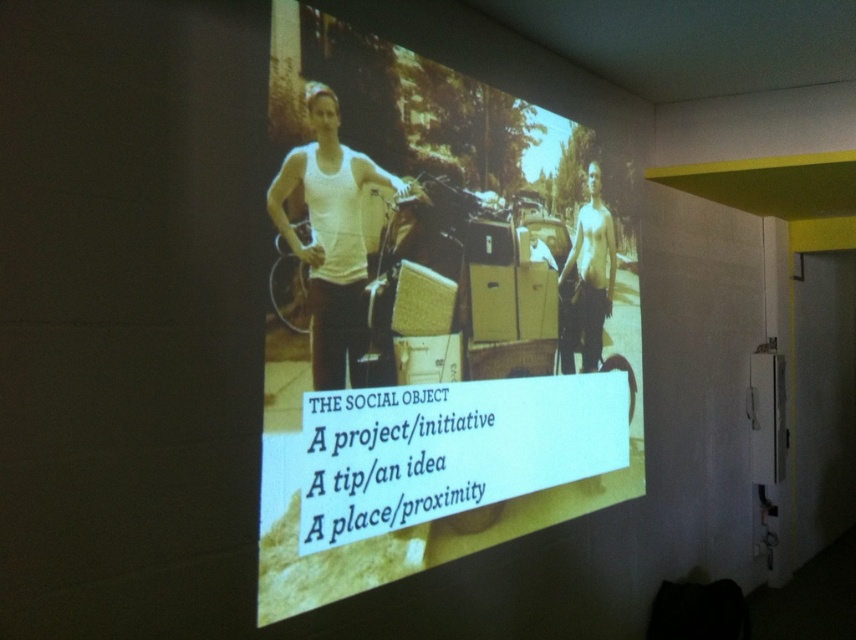
Question: Which object appears farthest from the camera in this image?

Choices:
 (A) yellowish cardboard boxes at center
 (B) shiny metallic man at center

Answer: (B)

Question: Does yellowish cardboard boxes at center appear under shiny metallic man at center?

Choices:
 (A) yes
 (B) no

Answer: (A)

Question: Among these objects, which one is nearest to the camera?

Choices:
 (A) white matte tank top at center
 (B) yellowish cardboard boxes at center

Answer: (B)

Question: Which of the following is the farthest from the observer?

Choices:
 (A) white matte tank top at center
 (B) shiny metallic man at center
 (C) yellowish cardboard boxes at center

Answer: (B)

Question: Is white matte tank top at center closer to camera compared to shiny metallic man at center?

Choices:
 (A) yes
 (B) no

Answer: (A)

Question: Considering the relative positions of white matte tank top at center and shiny metallic man at center in the image provided, where is white matte tank top at center located with respect to shiny metallic man at center?

Choices:
 (A) below
 (B) above

Answer: (B)